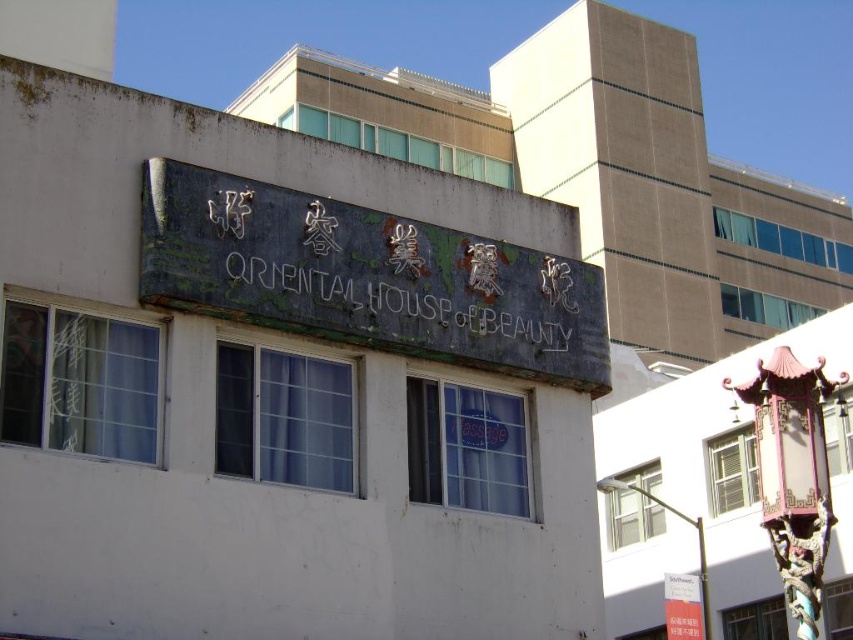
Question: Where is dark green stone sign at center located in relation to metallic pole at lower right in the image?

Choices:
 (A) below
 (B) above

Answer: (B)

Question: Which object is positioned farthest from the metallic pole at lower right?

Choices:
 (A) metallic signboard at center
 (B) dark green stone sign at center

Answer: (B)

Question: Does metallic signboard at center appear over metallic pole at lower right?

Choices:
 (A) no
 (B) yes

Answer: (A)

Question: In this image, where is metallic signboard at center located relative to metallic pole at lower right?

Choices:
 (A) left
 (B) right

Answer: (B)

Question: Which object appears farthest from the camera in this image?

Choices:
 (A) metallic pole at lower right
 (B) dark green stone sign at center
 (C) metallic signboard at center

Answer: (C)

Question: Which of the following is the closest to the observer?

Choices:
 (A) dark green stone sign at center
 (B) metallic signboard at center
 (C) metallic pole at lower right

Answer: (A)